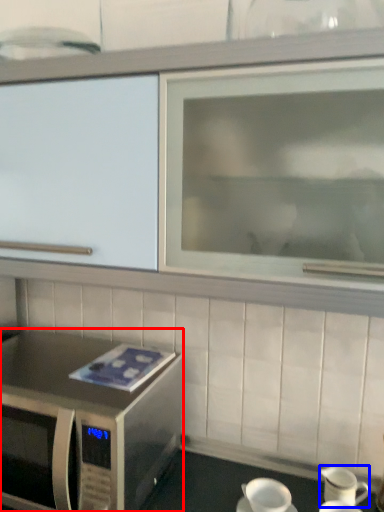
Question: Which point is closer to the camera, microwave oven (highlighted by a red box) or tableware (highlighted by a blue box)?

Choices:
 (A) microwave oven
 (B) tableware

Answer: (A)